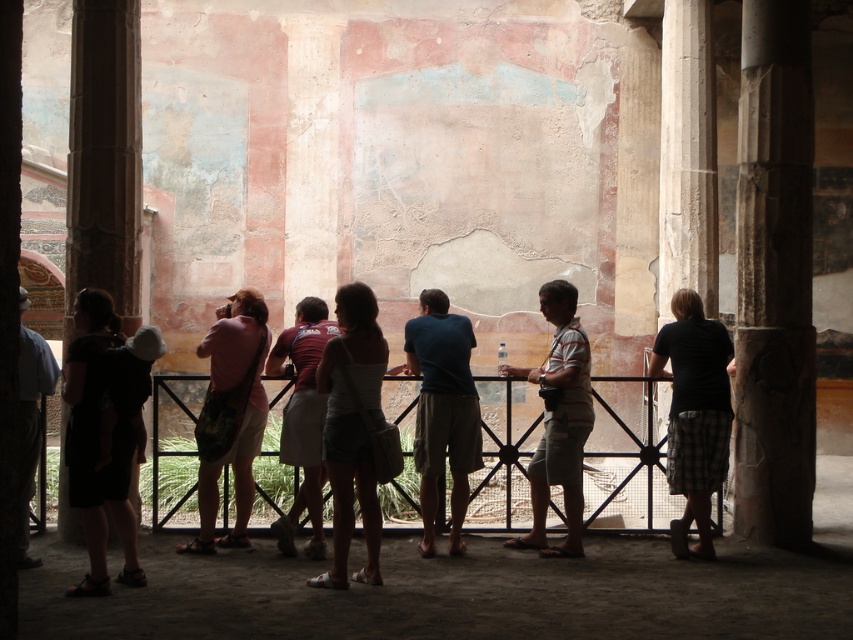
Is point (463, 364) closer to viewer compared to point (32, 557)?

No, (463, 364) is behind (32, 557).

Is point (426, 369) in front of point (44, 372)?

No, (426, 369) is behind (44, 372).

Find the location of a particular element. This screenshot has height=640, width=853. blue cotton shirt at center is located at coordinates [444, 410].

Does white fabric dress at center have a smaller size compared to striped cotton shirt at center?

No, white fabric dress at center is not smaller than striped cotton shirt at center.

How much distance is there between white fabric dress at center and striped cotton shirt at center?

They are 4.59 meters apart.

Measure the distance between white fabric dress at center and camera.

They are 22.09 meters apart.

The width and height of the screenshot is (853, 640). In order to click on white fabric dress at center in this screenshot , I will do `click(352, 428)`.

Between striped cotton shirt at center and maroon fabric shirt at center, which one has less height?

Standing shorter between the two is striped cotton shirt at center.

Can you confirm if striped cotton shirt at center is positioned to the left of maroon fabric shirt at center?

No, striped cotton shirt at center is not to the left of maroon fabric shirt at center.

Between point (581, 364) and point (321, 310), which one is positioned behind?

Point (321, 310)

The image size is (853, 640). What are the coordinates of `striped cotton shirt at center` in the screenshot? It's located at (560, 420).